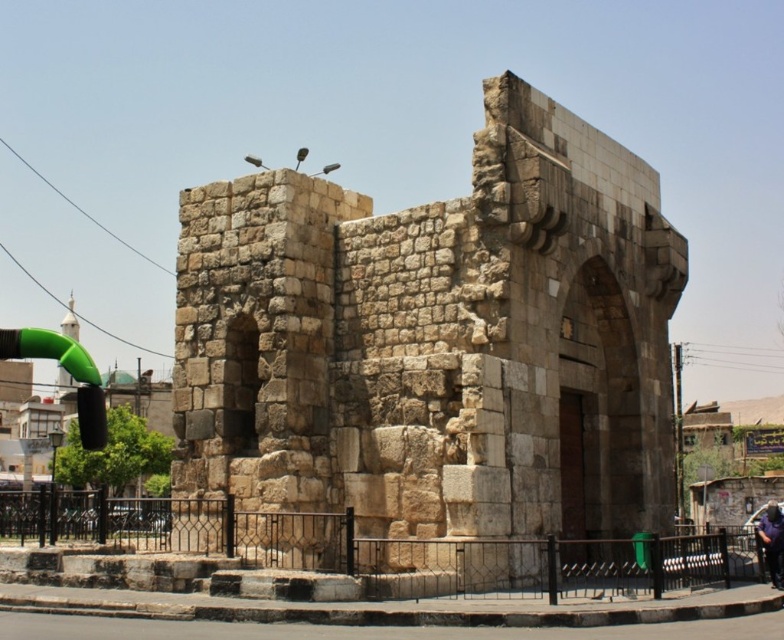
Question: Considering the relative positions of stone archway at center and dark blue shirt at lower right in the image provided, where is stone archway at center located with respect to dark blue shirt at lower right?

Choices:
 (A) right
 (B) left

Answer: (B)

Question: Which point is farther to the camera?

Choices:
 (A) (775, 572)
 (B) (423, 356)

Answer: (A)

Question: In this image, where is stone archway at center located relative to dark blue shirt at lower right?

Choices:
 (A) right
 (B) left

Answer: (B)

Question: Which object is farther from the camera taking this photo?

Choices:
 (A) stone archway at center
 (B) dark blue shirt at lower right

Answer: (B)

Question: Does stone archway at center have a larger size compared to dark blue shirt at lower right?

Choices:
 (A) no
 (B) yes

Answer: (A)